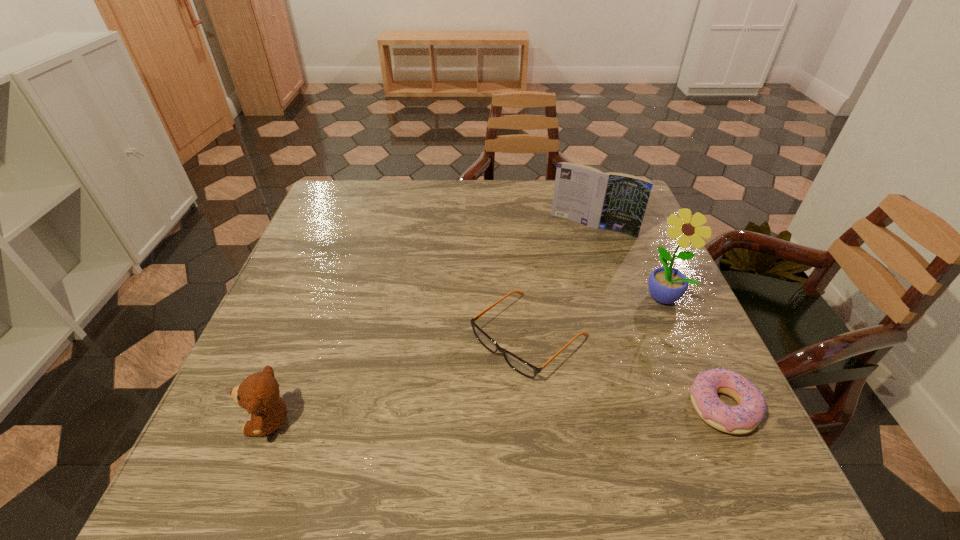
This screenshot has width=960, height=540. Find the location of `empty space between the farthest object and the sunflower`. empty space between the farthest object and the sunflower is located at coordinates (627, 261).

Where is `vacant point located between the doughnut and the tallest object`? The image size is (960, 540). vacant point located between the doughnut and the tallest object is located at coordinates (693, 351).

You are a GUI agent. You are given a task and a screenshot of the screen. Output one action in this format:
    pyautogui.click(x=<x>, y=<y>)
    Task: Click on the vacant space that's between the tallest object and the teddy bear
    
    Given the screenshot: What is the action you would take?
    [x=467, y=359]

Identify the location of object that stands as the third closest to the book. The width and height of the screenshot is (960, 540). (743, 418).

Identify which object is the third closest to the fourth shortest object. Please provide its 2D coordinates. Your answer should be formatted as a tuple, i.e. [(x, y)], where the tuple contains the x and y coordinates of a point satisfying the conditions above.

[(743, 418)]

Find the location of `vacant area in the image that satisfies the following two spatial constraints: 1. on the front side of the doughnut; 2. on the left side of the spectacles`. vacant area in the image that satisfies the following two spatial constraints: 1. on the front side of the doughnut; 2. on the left side of the spectacles is located at coordinates (537, 407).